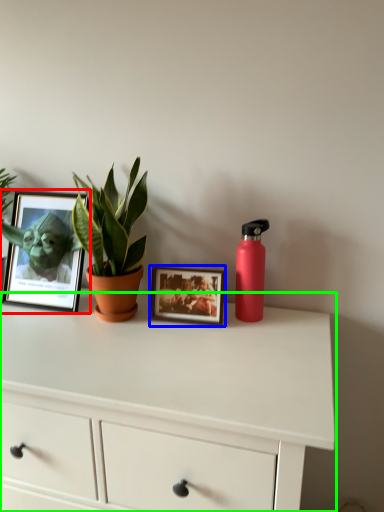
Question: Estimate the real-world distances between objects in this image. Which object is farther from picture frame (highlighted by a red box), picture frame (highlighted by a blue box) or chest of drawers (highlighted by a green box)?

Choices:
 (A) picture frame
 (B) chest of drawers

Answer: (B)